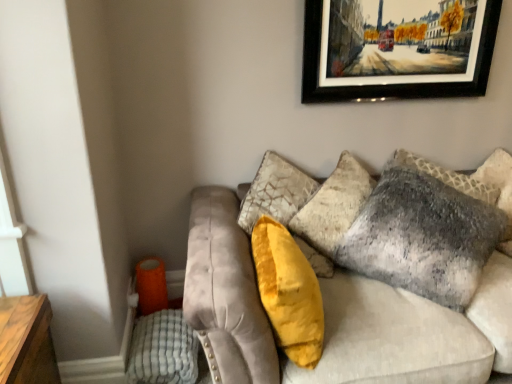
Question: Looking at their shapes, would you say wooden-framed painting at upper center is wider or thinner than textured gray pillow at upper right, marked as the second pillow in a right-to-left arrangement?

Choices:
 (A) wide
 (B) thin

Answer: (B)

Question: From the image's perspective, is wooden-framed painting at upper center positioned above or below textured gray pillow at upper right, which ranks as the second pillow in left-to-right order?

Choices:
 (A) below
 (B) above

Answer: (B)

Question: Estimate the real-world distances between objects in this image. Which object is farther from the textured gray pillow at upper right, the first pillow positioned from the right?

Choices:
 (A) wooden-framed painting at upper center
 (B) textured gray pillow at upper right, which ranks as the second pillow in left-to-right order
 (C) yellow fabric pillow at center, which is the third pillow in right-to-left order
 (D) velvet gray couch at center

Answer: (C)

Question: Which is nearer to the yellow fabric pillow at center, placed as the 1th pillow when sorted from left to right?

Choices:
 (A) velvet gray couch at center
 (B) textured gray pillow at upper right, which ranks as the second pillow in left-to-right order
 (C) textured gray pillow at upper right, which is the 3th pillow in left-to-right order
 (D) wooden-framed painting at upper center

Answer: (A)